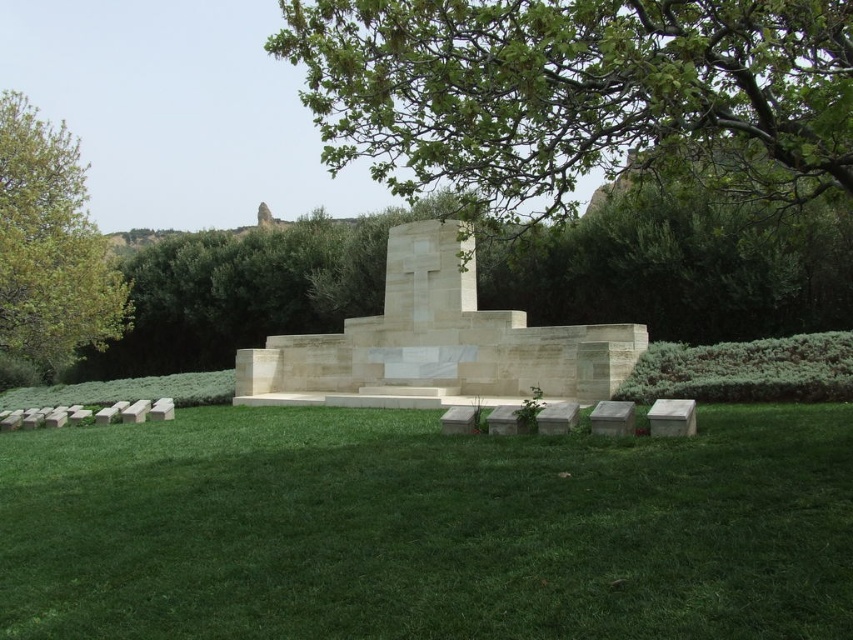
You are a visitor at the memorial site and want to place a wreath at the base of the monument. The path from the green leafy tree at upper center to the monument is 22.67 meters. Is this distance within a comfortable walking distance for an average adult?

The path from the green leafy tree at upper center to the monument is 22.67 meters, which is approximately 24.8 yards. This distance is considered a comfortable walking distance for an average adult as it is not excessively long and allows for a respectful approach to the monument.

You are standing at the point marked as point (426, 529) in the memorial site. Looking around, you see the large stone monument with a cross at its apex and the green grass at lower center. Which direction should you walk to reach the monument?

The green grass at lower center is located at point (426, 529). Since the monument is the central feature in front of which the grass area exists, you should walk towards the monument from the grass area. Therefore, walking forward from point (426, 529) towards the monument would be the correct direction.